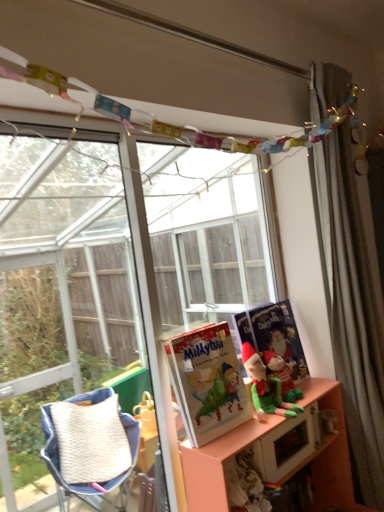
Question: Is matte paper book at center looking in the opposite direction of silky gray curtain at right?

Choices:
 (A) yes
 (B) no

Answer: (B)

Question: Is matte paper book at center next to silky gray curtain at right?

Choices:
 (A) no
 (B) yes

Answer: (A)

Question: Considering the relative sizes of matte paper book at center and silky gray curtain at right in the image provided, is matte paper book at center thinner than silky gray curtain at right?

Choices:
 (A) yes
 (B) no

Answer: (A)

Question: Is matte paper book at center smaller than silky gray curtain at right?

Choices:
 (A) yes
 (B) no

Answer: (A)

Question: From a real-world perspective, is matte paper book at center physically below silky gray curtain at right?

Choices:
 (A) no
 (B) yes

Answer: (B)

Question: Considering the relative sizes of matte paper book at center and silky gray curtain at right in the image provided, is matte paper book at center wider than silky gray curtain at right?

Choices:
 (A) yes
 (B) no

Answer: (B)

Question: From a real-world perspective, is matte blue paperback book at right positioned over silky gray curtain at right based on gravity?

Choices:
 (A) no
 (B) yes

Answer: (A)

Question: Is matte blue paperback book at right oriented away from silky gray curtain at right?

Choices:
 (A) yes
 (B) no

Answer: (B)

Question: Does matte blue paperback book at right have a larger size compared to silky gray curtain at right?

Choices:
 (A) yes
 (B) no

Answer: (B)

Question: Considering the relative sizes of matte blue paperback book at right and silky gray curtain at right in the image provided, is matte blue paperback book at right thinner than silky gray curtain at right?

Choices:
 (A) yes
 (B) no

Answer: (A)

Question: Could you tell me if matte blue paperback book at right is turned towards silky gray curtain at right?

Choices:
 (A) no
 (B) yes

Answer: (A)

Question: Can you confirm if matte blue paperback book at right is positioned to the right of silky gray curtain at right?

Choices:
 (A) no
 (B) yes

Answer: (A)

Question: Can you see green fabric elf at center touching pink matte shelf at lower right?

Choices:
 (A) no
 (B) yes

Answer: (A)